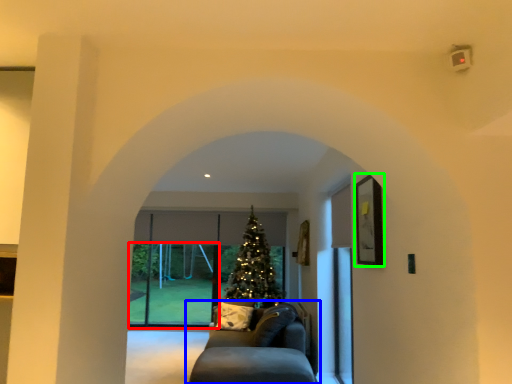
Question: Based on their relative distances, which object is nearer to glass door (highlighted by a red box)? Choose from studio couch (highlighted by a blue box) and picture frame (highlighted by a green box).

Choices:
 (A) studio couch
 (B) picture frame

Answer: (A)